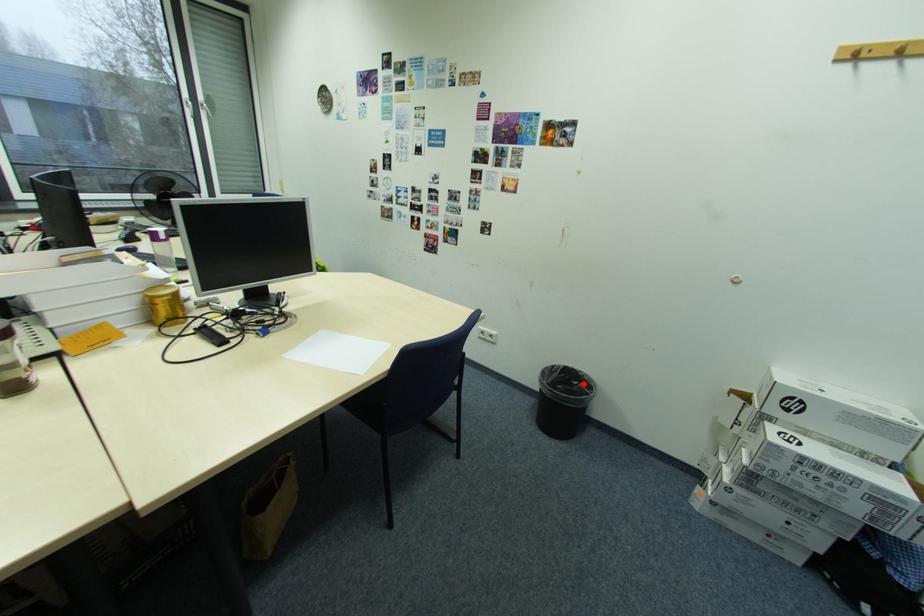
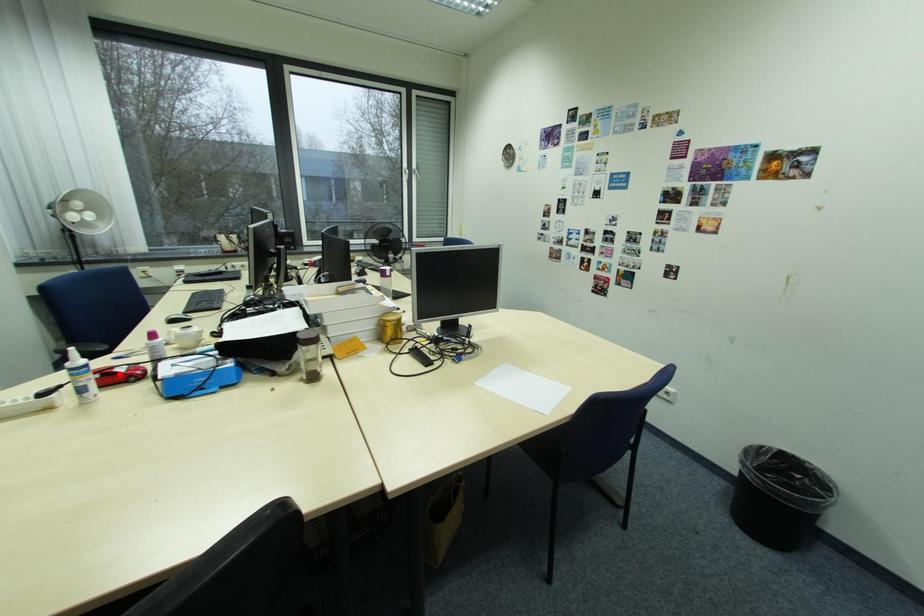
I am providing you with two images of the same scene from different viewpoints. A red point is marked on the first image and another point is marked on the second image. Do the highlighted points in image1 and image2 indicate the same real-world spot?

No